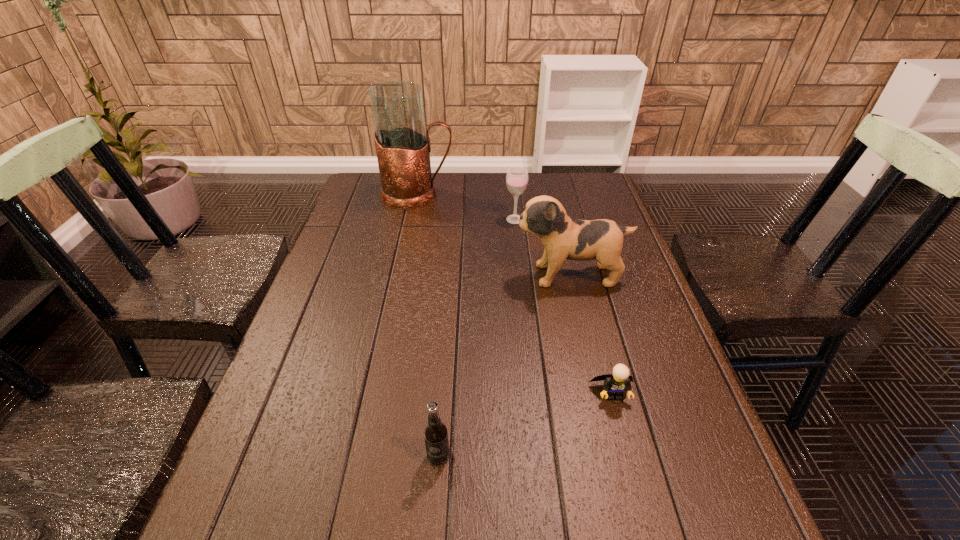
Image resolution: width=960 pixels, height=540 pixels. In the image, there is a desktop. In order to click on vacant space at the far edge in this screenshot , I will do `click(444, 197)`.

Image resolution: width=960 pixels, height=540 pixels. I want to click on vacant region at the left edge of the desktop, so click(x=319, y=394).

In the image, there is a desktop. Identify the location of vacant space at the right edge. (650, 360).

Find the location of a particular element. This screenshot has height=540, width=960. vacant space at the far left corner of the desktop is located at coordinates (356, 183).

Find the location of `vacant space at the far right corner`. vacant space at the far right corner is located at coordinates (589, 184).

Where is `vacant space at the near right corner of the desktop`? Image resolution: width=960 pixels, height=540 pixels. vacant space at the near right corner of the desktop is located at coordinates (717, 537).

Find the location of a particular element. The width and height of the screenshot is (960, 540). vacant space that is in between the fourth nearest object and the puppy is located at coordinates (542, 247).

This screenshot has height=540, width=960. Find the location of `blank region between the third farthest object and the fourth farthest object`. blank region between the third farthest object and the fourth farthest object is located at coordinates (591, 334).

Find the location of a particular element. The height and width of the screenshot is (540, 960). unoccupied position between the nearest object and the fourth shortest object is located at coordinates (504, 366).

This screenshot has height=540, width=960. Find the location of `free space between the second nearest object and the tallest object`. free space between the second nearest object and the tallest object is located at coordinates (516, 294).